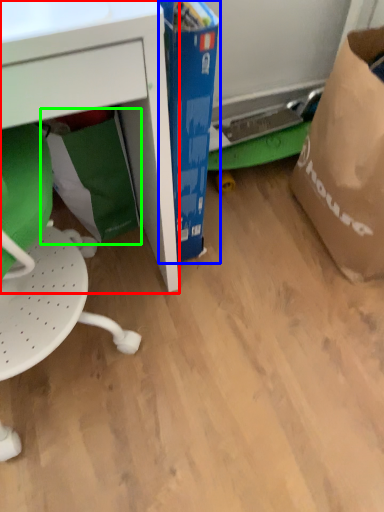
Question: Considering the real-world distances, which object is closest to desk (highlighted by a red box)? cardboard box (highlighted by a blue box) or grocery bag (highlighted by a green box).

Choices:
 (A) cardboard box
 (B) grocery bag

Answer: (A)